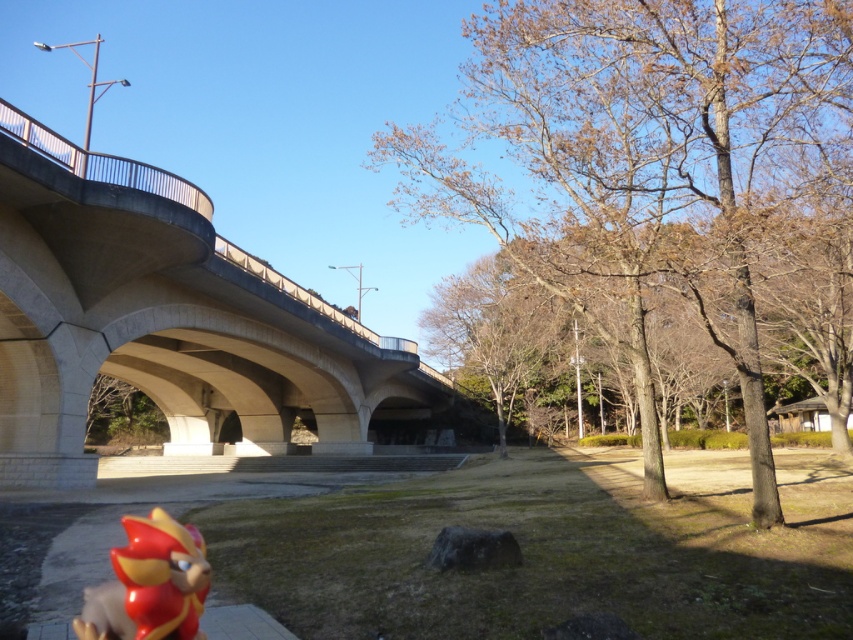
Between bare wood tree at center and shiny red plastic toy at lower left, which one has more height?

Standing taller between the two is bare wood tree at center.

Between bare wood tree at center and shiny red plastic toy at lower left, which one has less height?

shiny red plastic toy at lower left is shorter.

The width and height of the screenshot is (853, 640). Describe the element at coordinates (659, 170) in the screenshot. I see `bare wood tree at center` at that location.

This screenshot has width=853, height=640. Identify the location of bare wood tree at center. (659, 170).

Is bare wood tree at center further to the viewer compared to concrete bridge at left?

No, it is in front of concrete bridge at left.

This screenshot has width=853, height=640. Describe the element at coordinates (659, 170) in the screenshot. I see `bare wood tree at center` at that location.

What do you see at coordinates (659, 170) in the screenshot? This screenshot has height=640, width=853. I see `bare wood tree at center` at bounding box center [659, 170].

This screenshot has width=853, height=640. I want to click on bare wood tree at center, so click(659, 170).

Which of these two, concrete bridge at left or shiny red plastic toy at lower left, stands shorter?

shiny red plastic toy at lower left

Does concrete bridge at left appear under shiny red plastic toy at lower left?

Correct, concrete bridge at left is located below shiny red plastic toy at lower left.

Identify the location of concrete bridge at left. (166, 321).